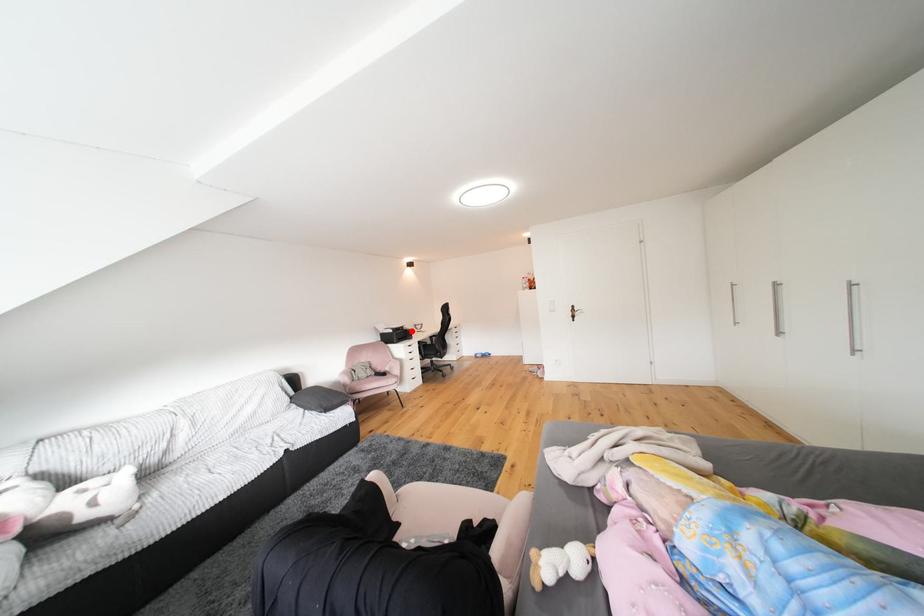
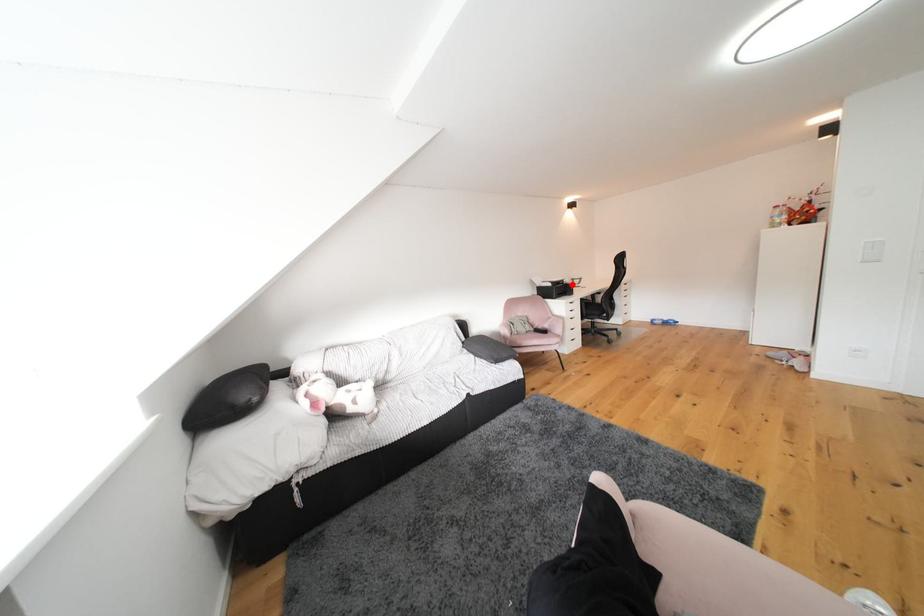
I am providing you with two images of the same scene from different viewpoints. A red point is marked on the first image and another point is marked on the second image. Is the marked point in image1 the same physical position as the marked point in image2?

Yes